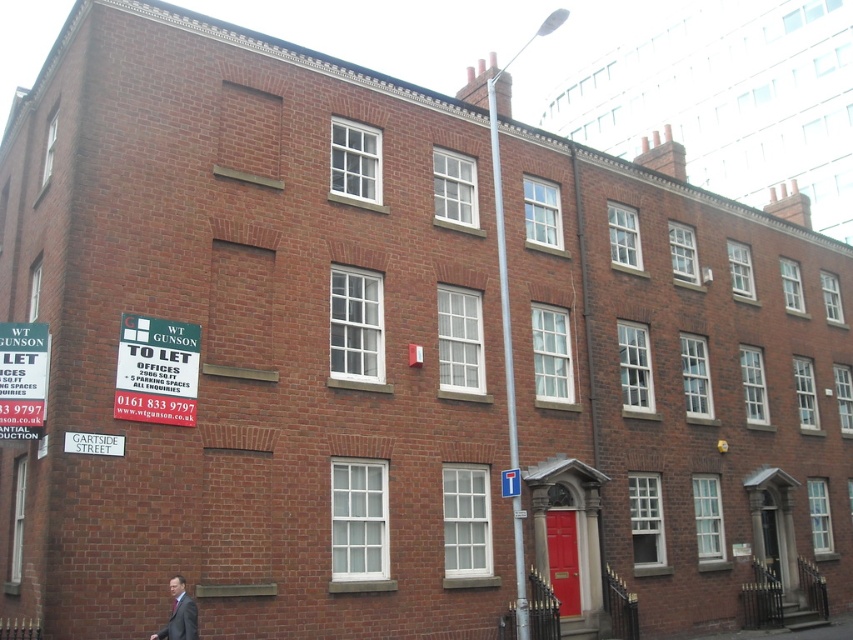
Question: Which object is positioned closest to the green plastic signboard at upper left?

Choices:
 (A) matte gray suit at lower left
 (B) white plastic street sign at lower left

Answer: (B)

Question: From the image, what is the correct spatial relationship of green plastic signboard at upper left in relation to white paper sign at upper left?

Choices:
 (A) above
 (B) below

Answer: (A)

Question: Is white paper sign at upper left above white plastic street sign at lower left?

Choices:
 (A) yes
 (B) no

Answer: (A)

Question: Is matte gray suit at lower left below white plastic street sign at lower left?

Choices:
 (A) no
 (B) yes

Answer: (B)

Question: Which object is closer to the camera taking this photo?

Choices:
 (A) white plastic street sign at lower left
 (B) white paper sign at upper left
 (C) green plastic signboard at upper left

Answer: (A)

Question: Which is farther from the green plastic signboard at upper left?

Choices:
 (A) white plastic street sign at lower left
 (B) white paper sign at upper left
 (C) matte gray suit at lower left

Answer: (C)